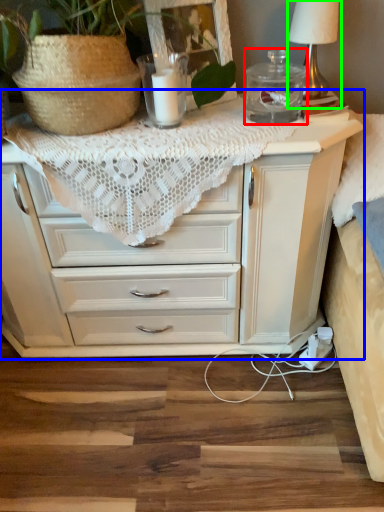
Question: Considering the real-world distances, which object is farthest from glass jar (highlighted by a red box)? chest of drawers (highlighted by a blue box) or table lamp (highlighted by a green box)?

Choices:
 (A) chest of drawers
 (B) table lamp

Answer: (A)